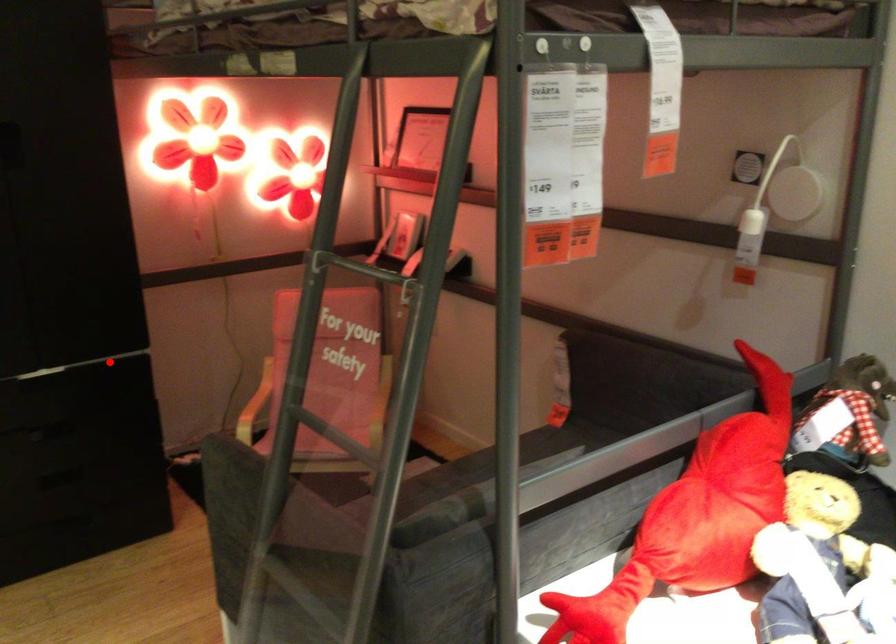
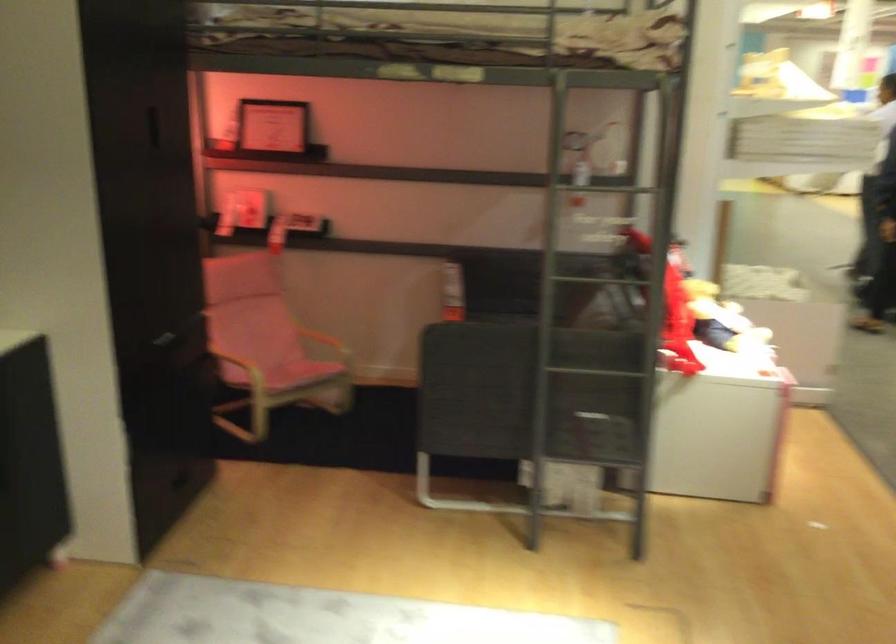
Locate, in the second image, the point that corresponds to the highlighted location in the first image.

(168, 337)